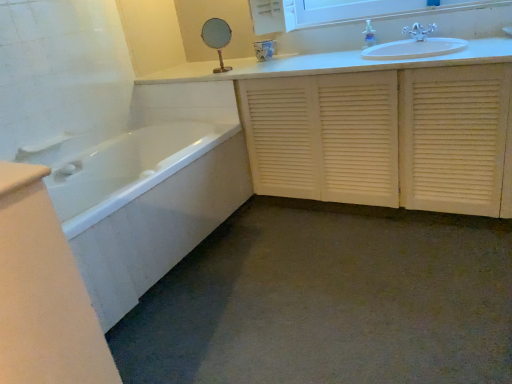
Question: Is clear plastic soap dispenser at upper center wider or thinner than white louvered cabinet at center?

Choices:
 (A) wide
 (B) thin

Answer: (B)

Question: Based on their positions, is clear plastic soap dispenser at upper center located to the left or right of white louvered cabinet at center?

Choices:
 (A) left
 (B) right

Answer: (A)

Question: Which object is positioned closest to the white louvered cabinet at center?

Choices:
 (A) clear plastic soap dispenser at upper center
 (B) white glossy bathtub at lower left
 (C) white plastic towel bar at left
 (D) white glossy medicine cabinet at upper center
 (E) silver metallic faucet at upper right

Answer: (A)

Question: Estimate the real-world distances between objects in this image. Which object is closer to the silver metallic faucet at upper right?

Choices:
 (A) white louvered cabinet at center
 (B) white glossy bathtub at lower left
 (C) white glossy medicine cabinet at upper center
 (D) white plastic towel bar at left
 (E) clear plastic soap dispenser at upper center

Answer: (E)